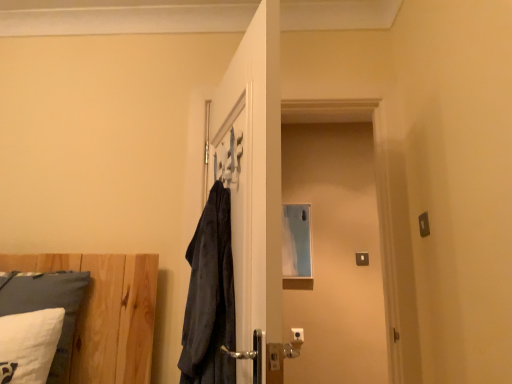
Question: Considering the relative positions of transparent glass screen door at center and white soft pillow at lower left in the image provided, is transparent glass screen door at center in front of white soft pillow at lower left?

Choices:
 (A) yes
 (B) no

Answer: (B)

Question: From the image's perspective, does transparent glass screen door at center appear lower than white soft pillow at lower left?

Choices:
 (A) no
 (B) yes

Answer: (A)

Question: Does transparent glass screen door at center appear on the right side of white soft pillow at lower left?

Choices:
 (A) no
 (B) yes

Answer: (B)

Question: Considering the relative sizes of transparent glass screen door at center and white soft pillow at lower left in the image provided, is transparent glass screen door at center wider than white soft pillow at lower left?

Choices:
 (A) no
 (B) yes

Answer: (A)

Question: Is transparent glass screen door at center positioned beyond the bounds of white soft pillow at lower left?

Choices:
 (A) no
 (B) yes

Answer: (B)

Question: Is transparent glass screen door at center far away from white soft pillow at lower left?

Choices:
 (A) no
 (B) yes

Answer: (B)

Question: Is white soft pillow at lower left located outside transparent glass screen door at center?

Choices:
 (A) no
 (B) yes

Answer: (B)

Question: Does white soft pillow at lower left have a greater height compared to transparent glass screen door at center?

Choices:
 (A) no
 (B) yes

Answer: (A)

Question: Is white soft pillow at lower left with transparent glass screen door at center?

Choices:
 (A) no
 (B) yes

Answer: (A)

Question: From the image's perspective, would you say white soft pillow at lower left is positioned over transparent glass screen door at center?

Choices:
 (A) no
 (B) yes

Answer: (A)

Question: Considering the relative positions of white soft pillow at lower left and transparent glass screen door at center in the image provided, is white soft pillow at lower left to the right of transparent glass screen door at center from the viewer's perspective?

Choices:
 (A) yes
 (B) no

Answer: (B)

Question: Does white soft pillow at lower left turn towards transparent glass screen door at center?

Choices:
 (A) no
 (B) yes

Answer: (A)

Question: Based on their sizes in the image, would you say transparent glass screen door at center is bigger or smaller than white soft pillow at lower left?

Choices:
 (A) small
 (B) big

Answer: (B)